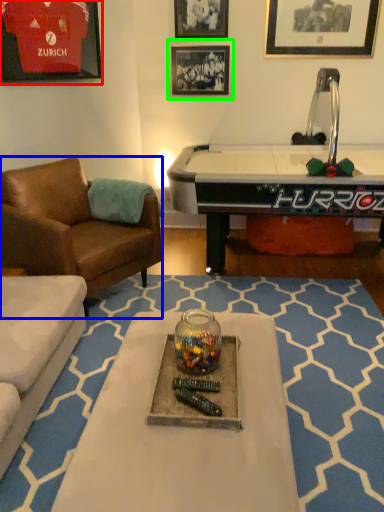
Question: Which object is positioned closest to picture frame (highlighted by a red box)? Select from chair (highlighted by a blue box) and picture frame (highlighted by a green box).

Choices:
 (A) chair
 (B) picture frame

Answer: (A)